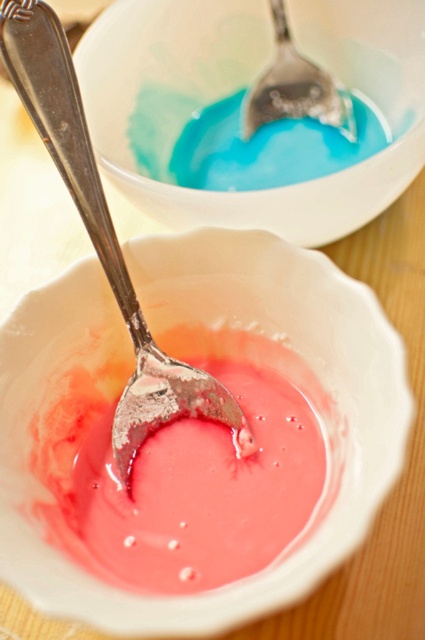
Is matte pink bowl at center further to camera compared to polished silver spoon at center?

No, it is in front of polished silver spoon at center.

Locate an element on the screen. The image size is (425, 640). matte pink bowl at center is located at coordinates (210, 324).

Which is more to the left, polished silver spoon at center or silver metallic spoon at upper center?

Positioned to the left is polished silver spoon at center.

Can you confirm if polished silver spoon at center is smaller than silver metallic spoon at upper center?

Incorrect, polished silver spoon at center is not smaller in size than silver metallic spoon at upper center.

The image size is (425, 640). What do you see at coordinates (104, 236) in the screenshot? I see `polished silver spoon at center` at bounding box center [104, 236].

Find the location of a particular element. The width and height of the screenshot is (425, 640). polished silver spoon at center is located at coordinates (104, 236).

Does matte white bowl at upper center have a lesser width compared to silver metallic spoon at upper center?

Incorrect, matte white bowl at upper center's width is not less than silver metallic spoon at upper center's.

Is matte white bowl at upper center wider than silver metallic spoon at upper center?

Indeed, matte white bowl at upper center has a greater width compared to silver metallic spoon at upper center.

Who is more distant from viewer, (413, 173) or (305, 83)?

Point (305, 83)

Find the location of a particular element. This screenshot has height=640, width=425. matte white bowl at upper center is located at coordinates (244, 84).